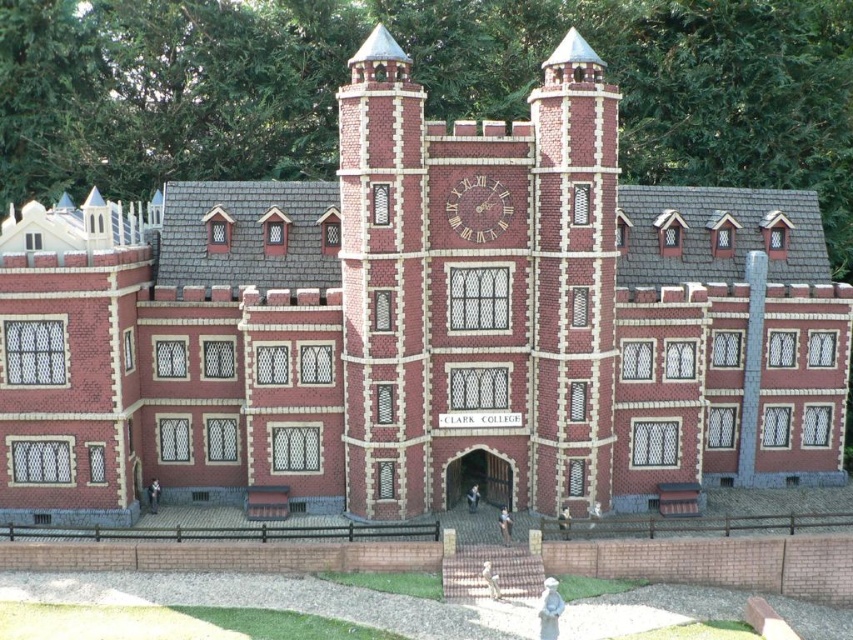
You are standing at the entrance of the grand building and see a point marked at coordinates [490,579]. What object is located at that position?

The point at coordinates [490,579] marks the location of the matte brick statue at lower center.